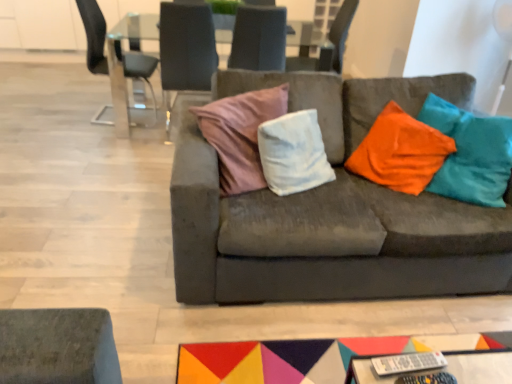
Question: Is velvet cushion at center, the third chair when ordered from right to left, in front of or behind suede-like gray chair at upper center, placed as the 4th chair when sorted from left to right, in the image?

Choices:
 (A) front
 (B) behind

Answer: (A)

Question: Is point (195, 26) positioned closer to the camera than point (334, 69)?

Choices:
 (A) farther
 (B) closer

Answer: (B)

Question: Which is nearer to the suede couch at center?

Choices:
 (A) transparent glass table at upper center
 (B) suede-like gray chair at upper center, the 2th chair viewed from the right
 (C) velvet cushion at center, the second chair from the left
 (D) suede-like gray chair at upper center, which is the 1th chair from right to left
 (E) metallic glass chair at upper left, the first chair from the left

Answer: (B)

Question: Estimate the real-world distances between objects in this image. Which object is closer to the metallic glass chair at upper left, which is the 4th chair in right-to-left order?

Choices:
 (A) suede-like gray chair at upper center, placed as the 4th chair when sorted from left to right
 (B) velvet cushion at center, the third chair when ordered from right to left
 (C) transparent glass table at upper center
 (D) suede couch at center
 (E) suede-like gray chair at upper center, the 2th chair viewed from the right

Answer: (C)